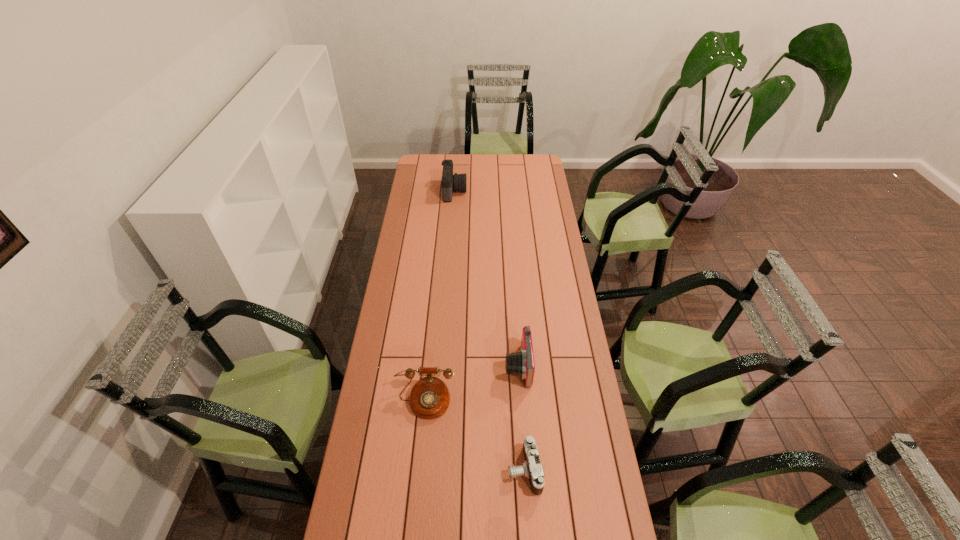
Where is `the leftmost camera`? The width and height of the screenshot is (960, 540). the leftmost camera is located at coordinates (457, 182).

You are a GUI agent. You are given a task and a screenshot of the screen. Output one action in this format:
    pyautogui.click(x=<x>, y=<y>)
    Task: Click on the farthest camera
    
    Given the screenshot: What is the action you would take?
    pyautogui.click(x=457, y=182)

Where is `telephone`? telephone is located at coordinates (429, 398).

This screenshot has width=960, height=540. What are the coordinates of `the second farthest camera` in the screenshot? It's located at (521, 364).

The width and height of the screenshot is (960, 540). Identify the location of the nearest object. (531, 468).

Identify the location of the nearest camera. Image resolution: width=960 pixels, height=540 pixels. [x=531, y=468].

What are the coordinates of `vacant area situated 0.050m at the lens of the farthest object` in the screenshot? It's located at (475, 191).

Where is `vacant space situated on the dial of the telephone`? This screenshot has width=960, height=540. vacant space situated on the dial of the telephone is located at coordinates (415, 507).

This screenshot has width=960, height=540. I want to click on vacant space located on the front-facing side of the second nearest camera, so click(x=481, y=366).

Locate an element on the screen. Image resolution: width=960 pixels, height=540 pixels. vacant region located on the front-facing side of the second nearest camera is located at coordinates (486, 366).